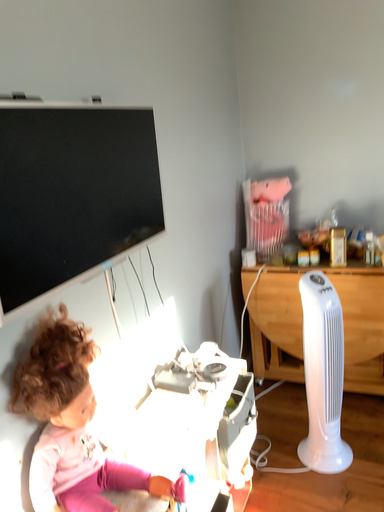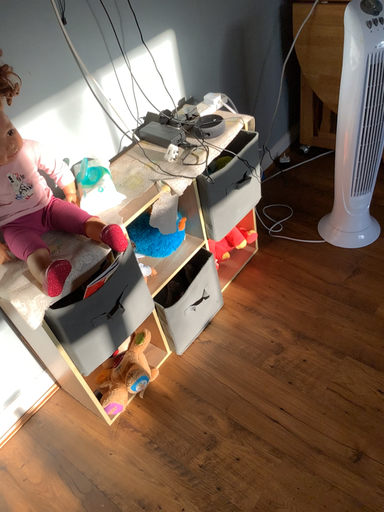
Question: Which way did the camera rotate in the video?

Choices:
 (A) rotated left
 (B) rotated right

Answer: (A)